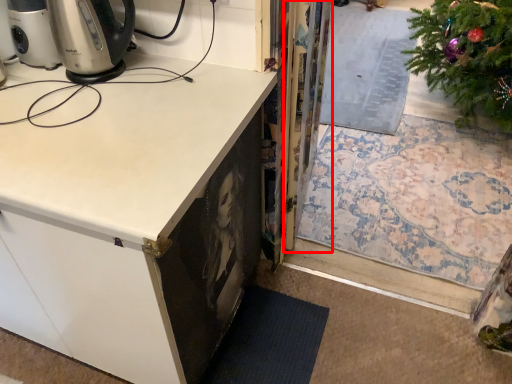
Question: From the image's perspective, where is screen door (annotated by the red box) located relative to cabinetry?

Choices:
 (A) above
 (B) below

Answer: (A)